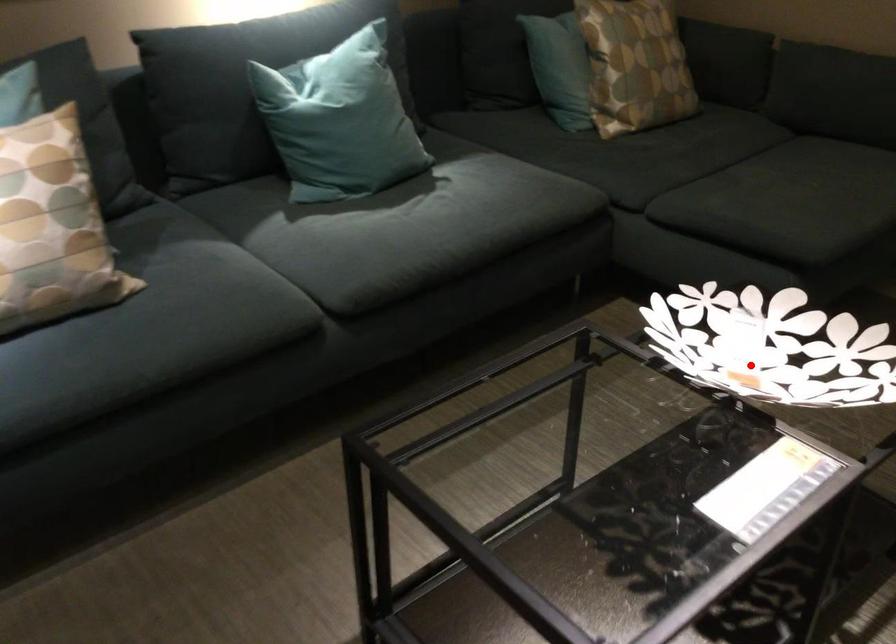
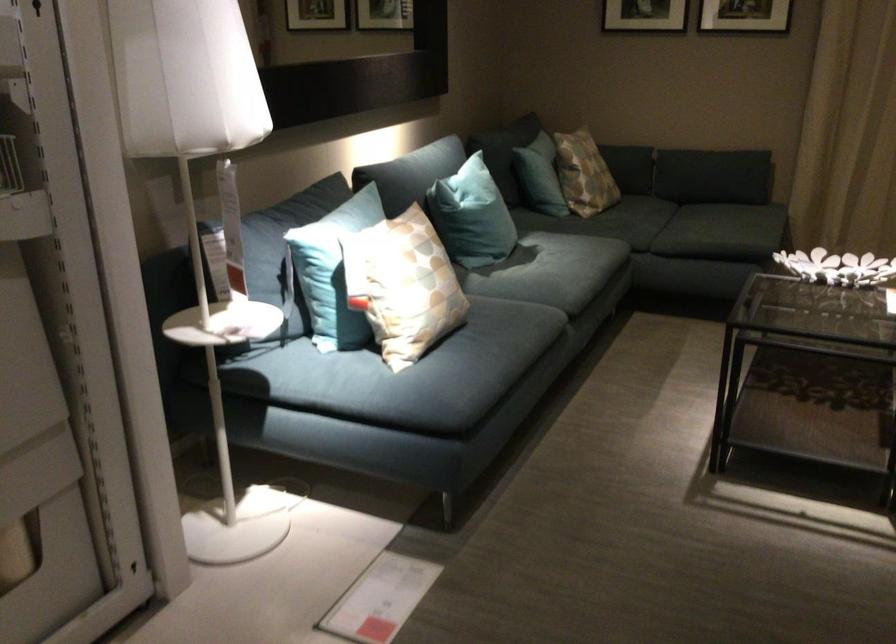
Question: I am providing you with two images of the same scene from different viewpoints. In image1, a red point is highlighted. Considering the same 3D point in image2, which of the following is correct?

Choices:
 (A) It is closer
 (B) It is farther

Answer: (B)